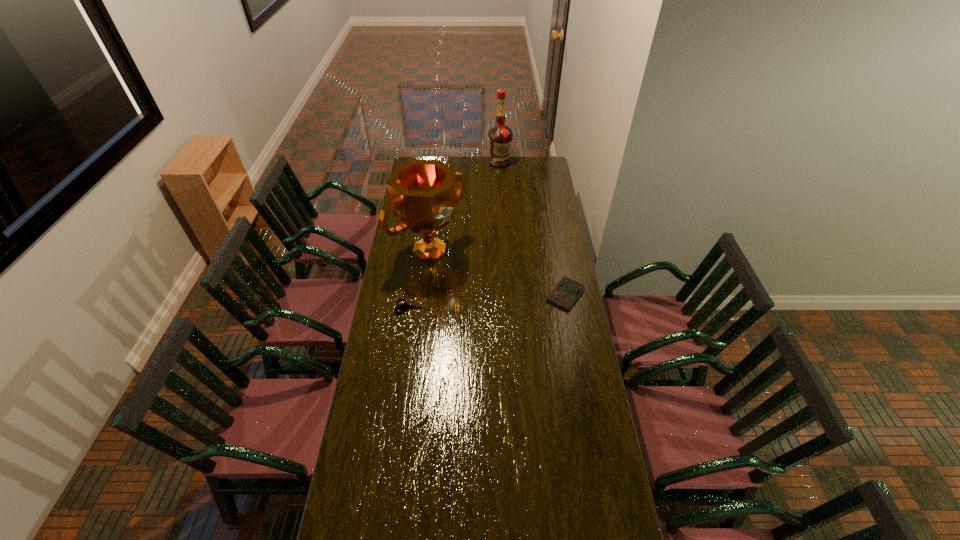
Identify the location of free space at the right edge. (534, 193).

Where is `vacant area at the near right corner`? vacant area at the near right corner is located at coordinates (583, 505).

Where is `free space between the second farthest object and the calculator`? free space between the second farthest object and the calculator is located at coordinates (497, 273).

Identify the location of free space between the second shortest object and the third nearest object. Image resolution: width=960 pixels, height=540 pixels. (497, 273).

At what (x,y) coordinates should I click in order to perform the action: click on unoccupied area between the third nearest object and the liquor. Please return your answer as a coordinate pair (x, y). The width and height of the screenshot is (960, 540). Looking at the image, I should click on (465, 206).

Identify the location of free space between the farthest object and the award. The width and height of the screenshot is (960, 540). (465, 206).

Locate an element on the screen. This screenshot has width=960, height=540. vacant space that's between the shortest object and the third object from left to right is located at coordinates (455, 235).

Where is `free area in between the shears and the second shortest object`? free area in between the shears and the second shortest object is located at coordinates (488, 301).

Locate an element on the screen. vacant area that lies between the second object from right to left and the award is located at coordinates (465, 206).

Where is `free point between the second object from right to left and the third nearest object`? This screenshot has width=960, height=540. free point between the second object from right to left and the third nearest object is located at coordinates (465, 206).